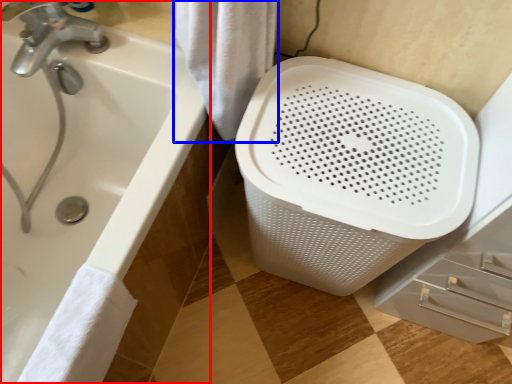
Question: Which point is closer to the camera, bathtub (highlighted by a red box) or bath towel (highlighted by a blue box)?

Choices:
 (A) bathtub
 (B) bath towel

Answer: (A)